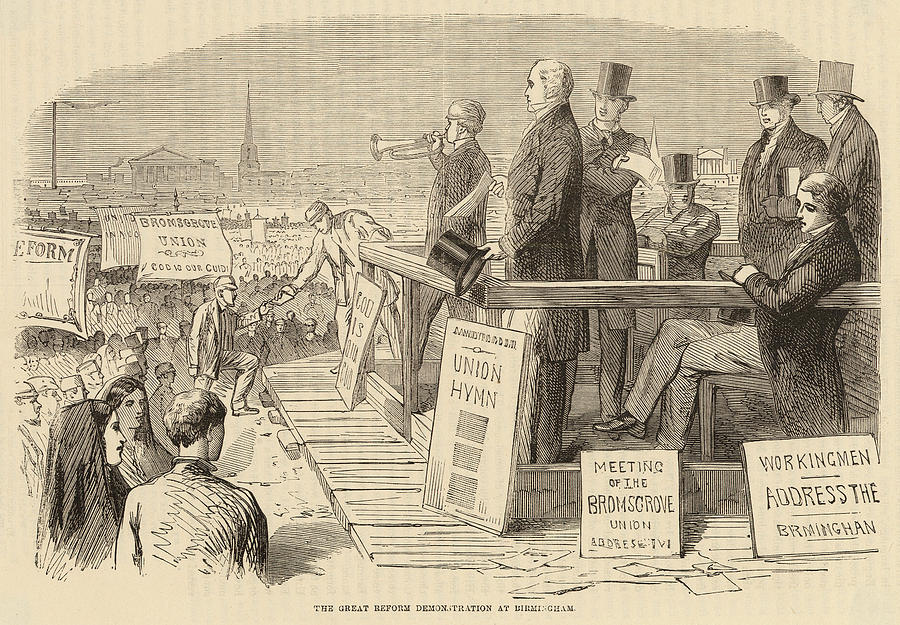
Find the location of `chair`. chair is located at coordinates (753, 386).